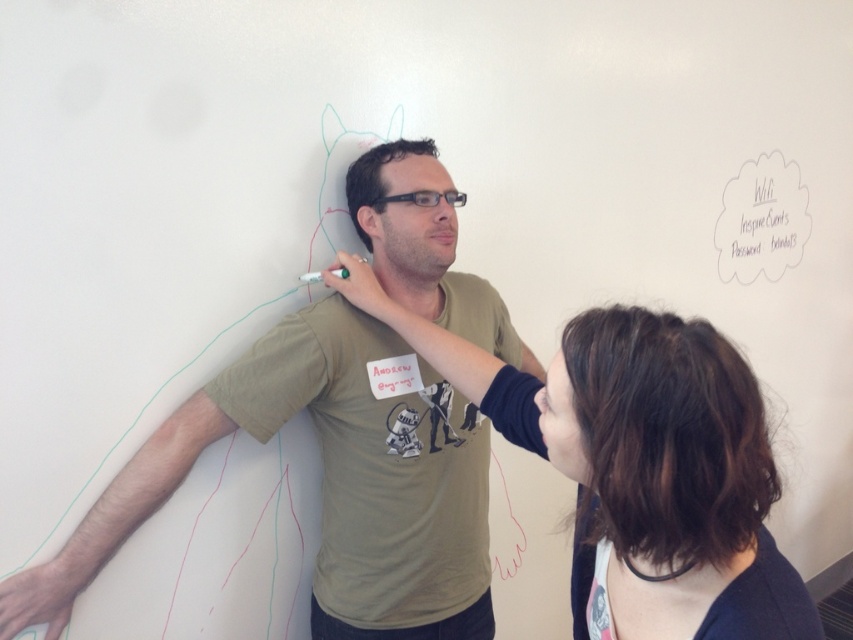
In the scene shown: You are standing at the camera position and want to reach point [71,579]. Can you walk directly to it without moving around any objects?

The distance between point [71,579] and the camera is 4.08 feet. Since there are no obstacles mentioned between you and the point, you can walk directly to it.